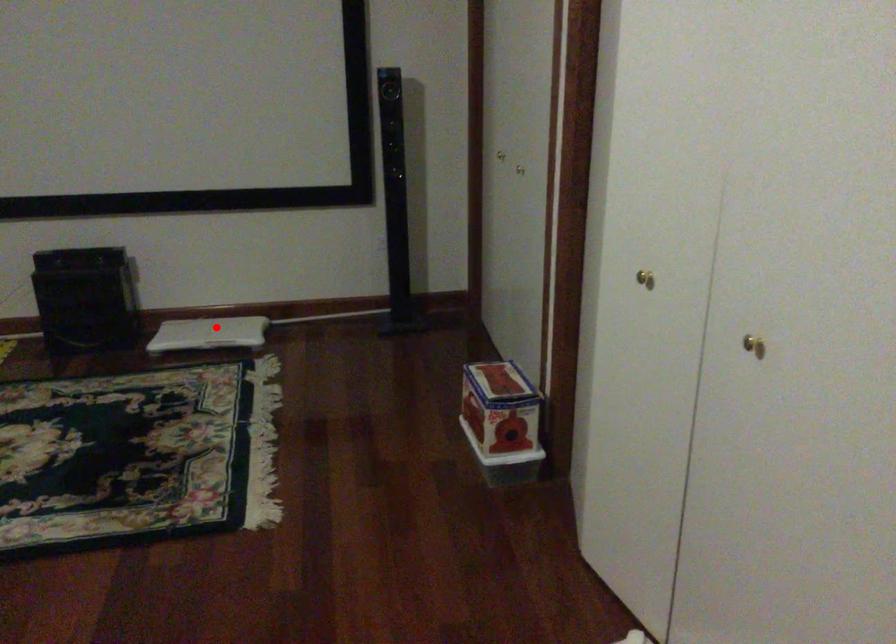
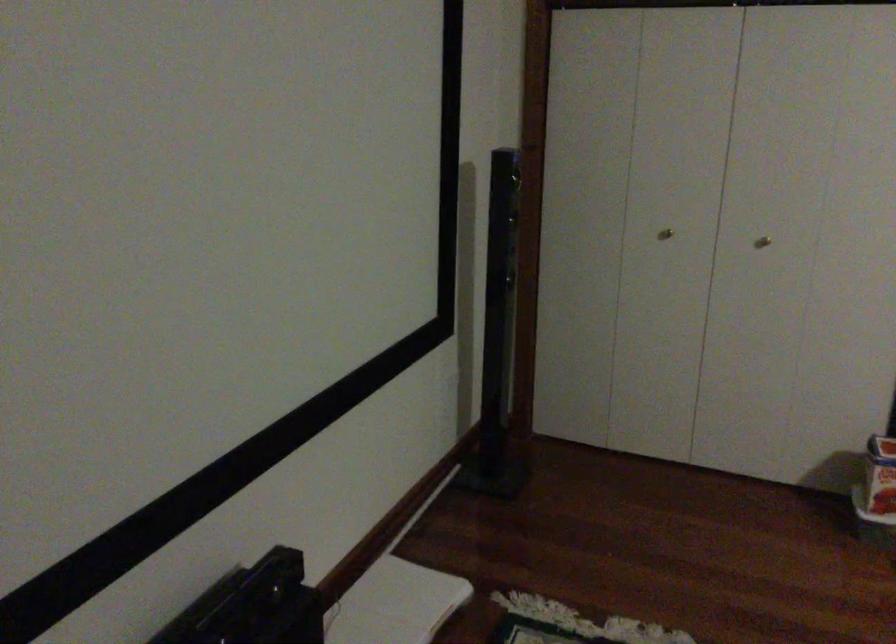
Locate, in the second image, the point that corresponds to the highlighted location in the first image.

(394, 603)